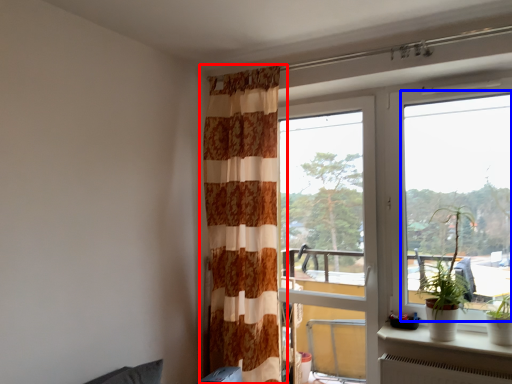
Question: Which point is further to the camera, curtain (highlighted by a red box) or window (highlighted by a blue box)?

Choices:
 (A) curtain
 (B) window

Answer: (A)